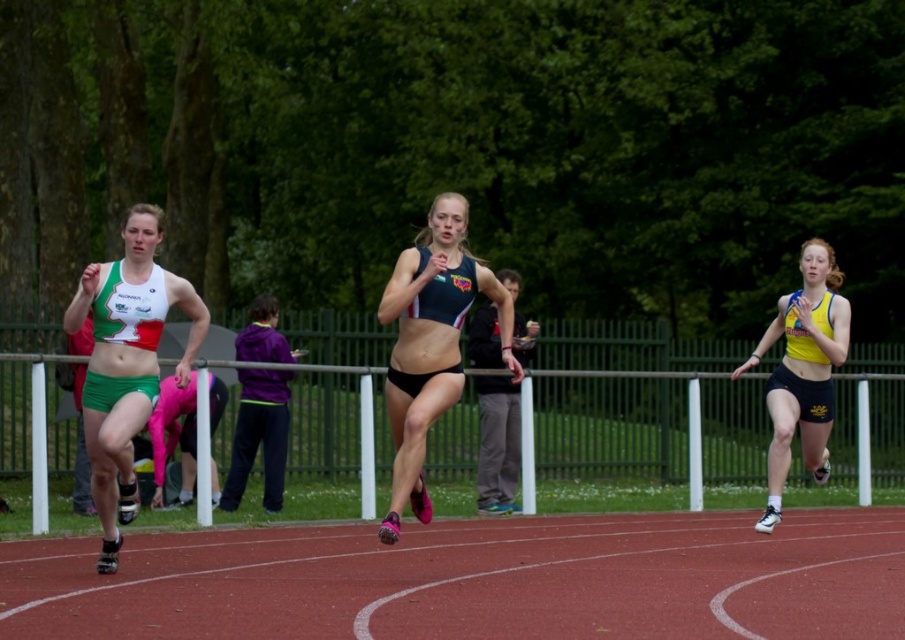
Between white plastic rail at center and black matte shorts at center, which one is positioned lower?

Positioned lower is white plastic rail at center.

Find the location of a particular element. white plastic rail at center is located at coordinates click(x=37, y=433).

Between point (40, 516) and point (499, 410), which one is positioned in front?

Point (40, 516)

Locate an element on the screen. white plastic rail at center is located at coordinates pos(37,433).

This screenshot has height=640, width=905. What are the coordinates of `rubberized red track at center` in the screenshot? It's located at (475, 580).

Identify the location of rubberized red track at center. The width and height of the screenshot is (905, 640). (475, 580).

Is yellow matte tank top at right shorter than black matte shorts at center?

Yes, yellow matte tank top at right is shorter than black matte shorts at center.

The height and width of the screenshot is (640, 905). Describe the element at coordinates (802, 371) in the screenshot. I see `yellow matte tank top at right` at that location.

Is point (792, 371) closer to viewer compared to point (491, 486)?

That is True.

Where is `yellow matte tank top at right`? yellow matte tank top at right is located at coordinates (802, 371).